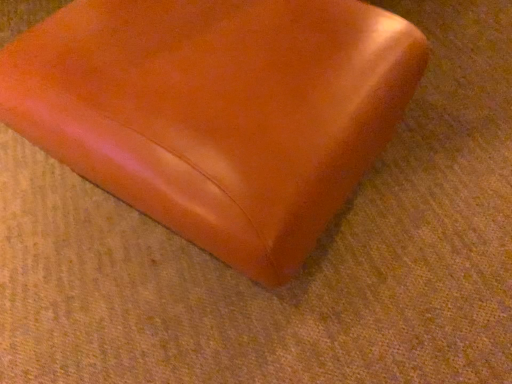
Describe the element at coordinates (218, 111) in the screenshot. I see `satin orange cushion at center` at that location.

Locate an element on the screen. The width and height of the screenshot is (512, 384). satin orange cushion at center is located at coordinates (218, 111).

Find the location of a particular element. The height and width of the screenshot is (384, 512). satin orange cushion at center is located at coordinates (218, 111).